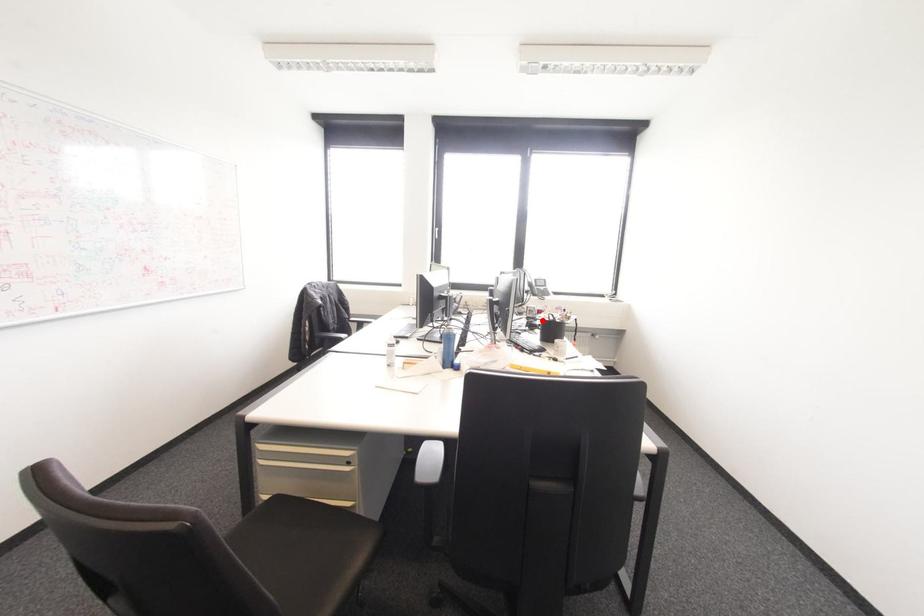
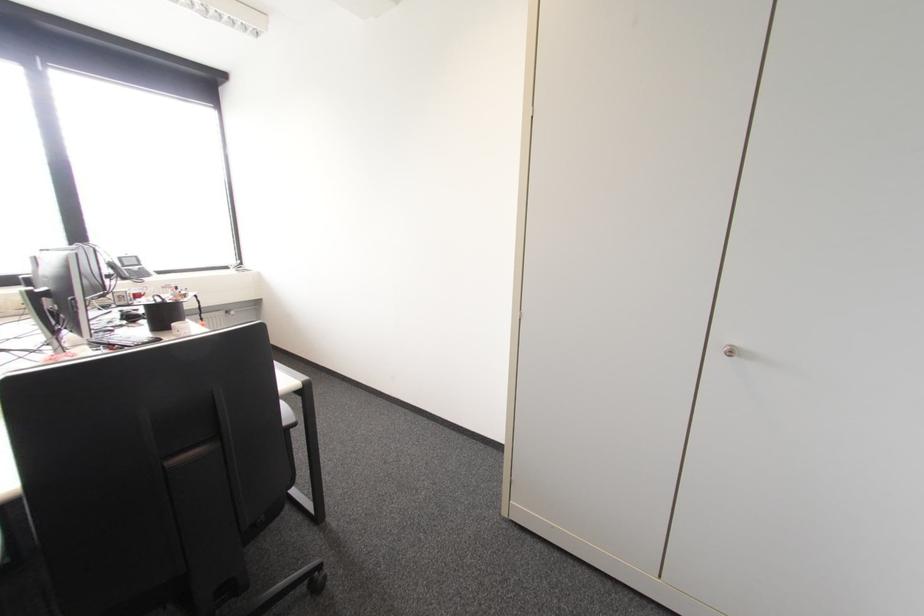
Question: I am providing you with two images of the same scene from different viewpoints. In image1, a red point is highlighted. Considering the same 3D point in image2, which of the following is correct?

Choices:
 (A) It is closer
 (B) It is farther

Answer: (B)